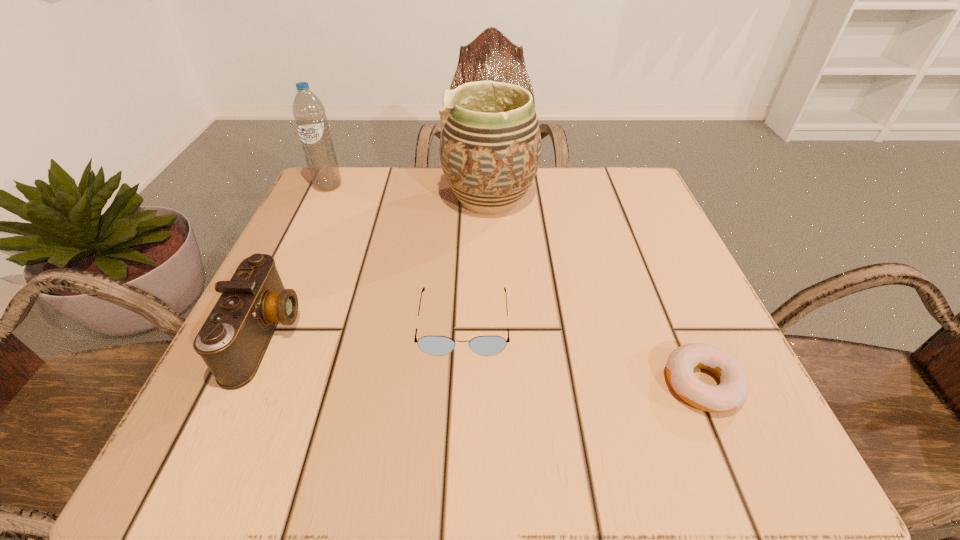
At what (x,y) coordinates should I click in order to perform the action: click on free space between the spectacles and the water bottle. Please return your answer as a coordinate pair (x, y). Looking at the image, I should click on (396, 254).

The height and width of the screenshot is (540, 960). I want to click on empty location between the spectacles and the water bottle, so click(396, 254).

I want to click on empty space between the pottery and the camera, so click(x=378, y=267).

In order to click on free space between the spectacles and the pottery in this screenshot , I will do `click(476, 261)`.

What are the coordinates of `vacant region between the water bottle and the second shortest object` in the screenshot? It's located at (396, 254).

Point out which object is positioned as the second nearest to the shortest object. Please provide its 2D coordinates. Your answer should be formatted as a tuple, i.e. [(x, y)], where the tuple contains the x and y coordinates of a point satisfying the conditions above.

[(490, 144)]

Identify which object is the closest to the third shortest object. Please provide its 2D coordinates. Your answer should be formatted as a tuple, i.e. [(x, y)], where the tuple contains the x and y coordinates of a point satisfying the conditions above.

[(432, 345)]

The width and height of the screenshot is (960, 540). What are the coordinates of `free location that satisfies the following two spatial constraints: 1. on the front side of the pottery; 2. on the lens of the camera` in the screenshot? It's located at (493, 335).

Find the location of a particular element. The height and width of the screenshot is (540, 960). free spot that satisfies the following two spatial constraints: 1. on the lenses of the spectacles; 2. on the lens of the camera is located at coordinates (463, 335).

This screenshot has height=540, width=960. Identify the location of blank space that satisfies the following two spatial constraints: 1. on the back side of the shortest object; 2. on the lens of the camera. (682, 335).